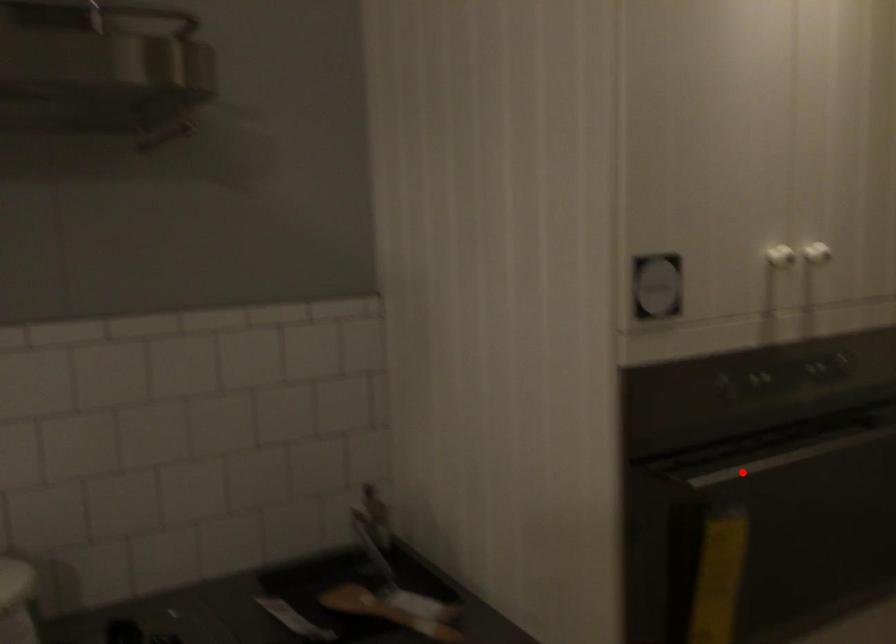
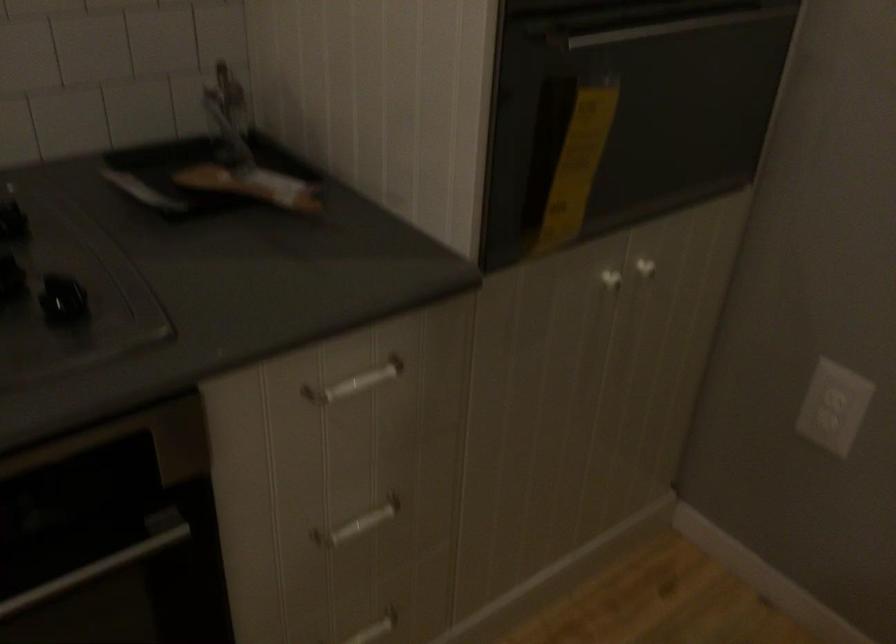
Where in the second image is the point corresponding to the highlighted location from the first image?

(622, 31)